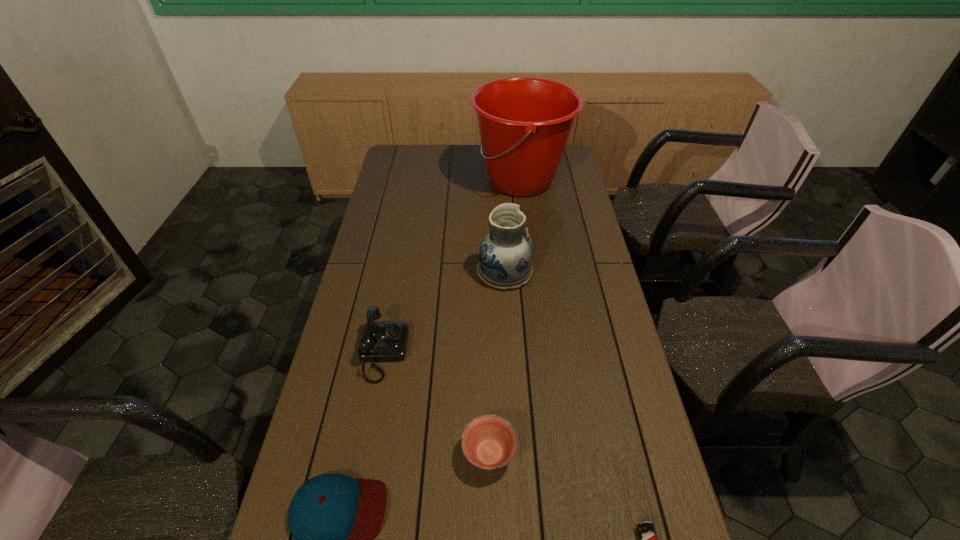
This screenshot has width=960, height=540. In the image, there is a desktop. What are the coordinates of `vacant region at the far left corner` in the screenshot? It's located at (411, 156).

Identify the location of unoccupied area between the pottery and the fourth nearest object. The width and height of the screenshot is (960, 540). (444, 312).

Where is `empty space that is in between the bowl and the fifth shortest object`? empty space that is in between the bowl and the fifth shortest object is located at coordinates (497, 362).

Image resolution: width=960 pixels, height=540 pixels. I want to click on vacant point located between the fifth shortest object and the telephone, so click(444, 312).

Identify the location of empty location between the tallest object and the fourth shortest object. Image resolution: width=960 pixels, height=540 pixels. (452, 266).

Identify which object is the fourth closest to the bowl. Please provide its 2D coordinates. Your answer should be formatted as a tuple, i.e. [(x, y)], where the tuple contains the x and y coordinates of a point satisfying the conditions above.

[(505, 257)]

Identify the location of object that is the second closest one to the beer can. (333, 518).